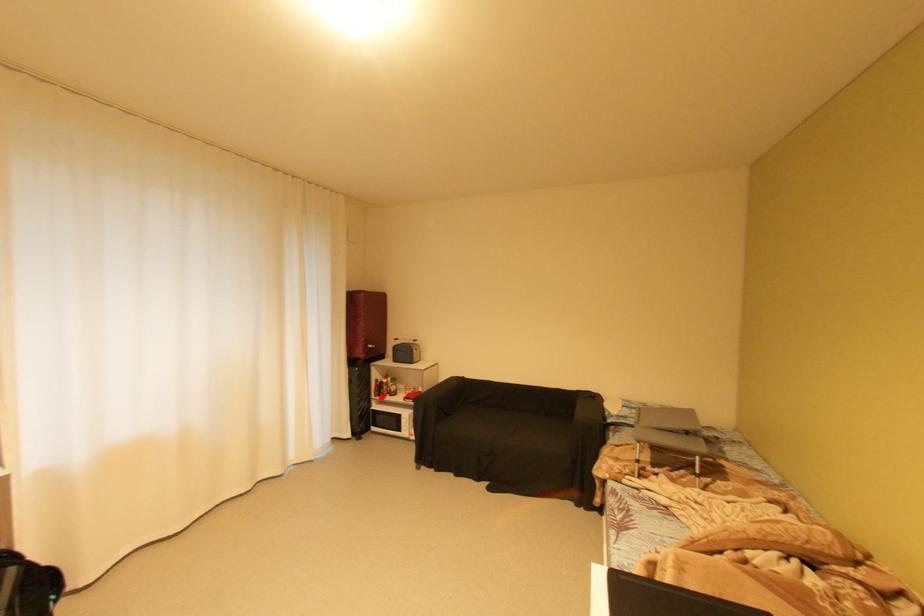
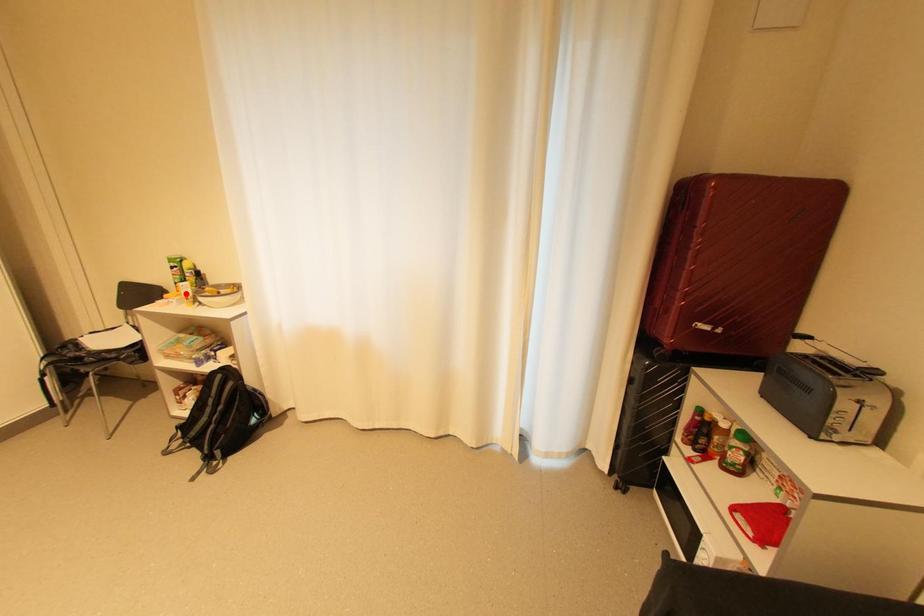
I am providing you with two images of the same scene from different viewpoints. A red point is marked on the first image and another point is marked on the second image. Is the marked point in image1 the same physical position as the marked point in image2?

No